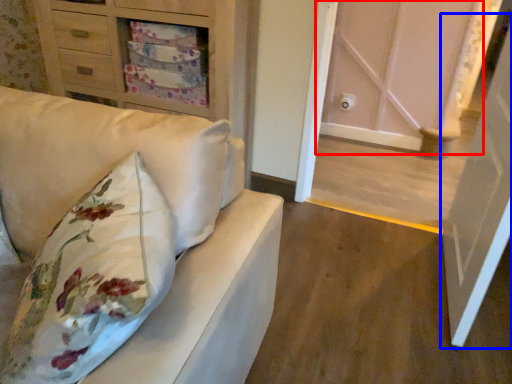
Question: Among these objects, which one is farthest to the camera, door (highlighted by a red box) or door (highlighted by a blue box)?

Choices:
 (A) door
 (B) door

Answer: (A)